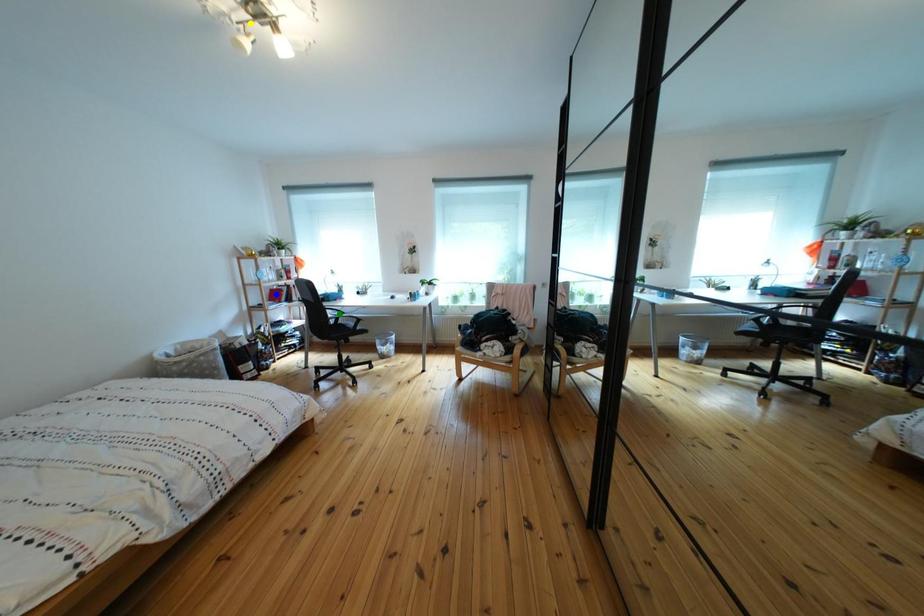
Order these from nearest to farthest:
yellow point, blue point, green point

yellow point
blue point
green point